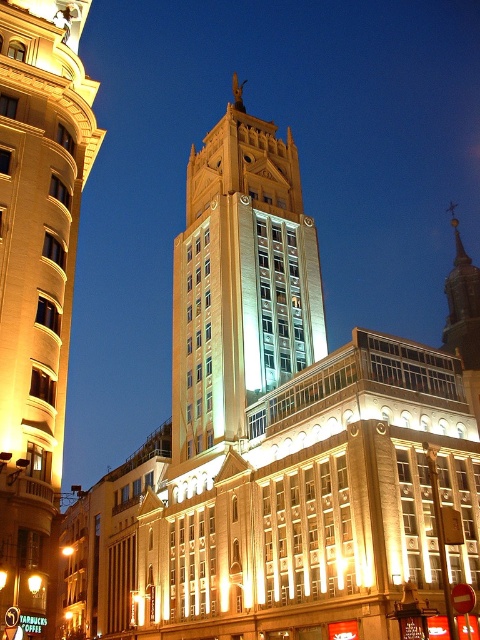
You are an architect reviewing the design plans for a new building. The design includes the matte gold building at center and the golden stone bell tower at center. According to the spatial specifications, which structure has a larger footprint?

The golden stone bell tower at center has a larger footprint than the matte gold building at center, as it is stated that the matte gold building at center is smaller than the golden stone bell tower at center.

You are an architect reviewing a design blueprint. You notice two elements in the proposed building facade design. The first is the matte gold building at center, and the second is the golden stone bell tower at center. According to the blueprint, which of these two elements is placed to the left of the other?

The matte gold building at center is positioned on the left side of the golden stone bell tower at center.

You are standing in front of the grand building and want to enter the main entrance. Which object should you look for first, the matte gold building at center or the golden stone bell tower at center?

You should look for the matte gold building at center first because it is positioned under the golden stone bell tower at center, meaning it is lower and closer to the ground level where the entrance would be located.